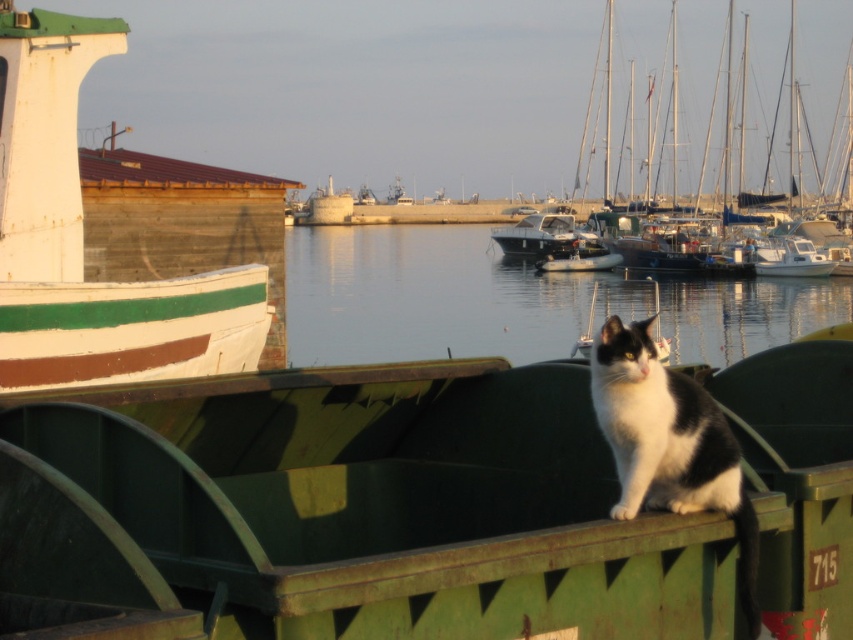
Is black and white fur cat at center smaller than white glossy boat at center?

Yes, black and white fur cat at center is smaller than white glossy boat at center.

Who is more forward, (653, 403) or (524, 252)?

Point (653, 403) is in front.

Where is `black and white fur cat at center`? The height and width of the screenshot is (640, 853). black and white fur cat at center is located at coordinates (669, 444).

Is point (35, 522) closer to camera compared to point (717, 448)?

Yes, point (35, 522) is in front of point (717, 448).

This screenshot has width=853, height=640. What do you see at coordinates (349, 509) in the screenshot?
I see `green matte boat at center` at bounding box center [349, 509].

Between point (138, 572) and point (750, 589), which one is positioned behind?

Point (750, 589)

Find the location of a particular element. The height and width of the screenshot is (640, 853). green matte boat at center is located at coordinates (349, 509).

Is point (605, 10) more distant than point (527, 333)?

That is True.

Is point (811, 13) positioned before point (691, 314)?

No, it is behind (691, 314).

Measure the distance between white glossy sailboat at upper right and camera.

The distance of white glossy sailboat at upper right from camera is 75.57 meters.

The image size is (853, 640). What are the coordinates of `white glossy sailboat at upper right` in the screenshot? It's located at (659, 99).